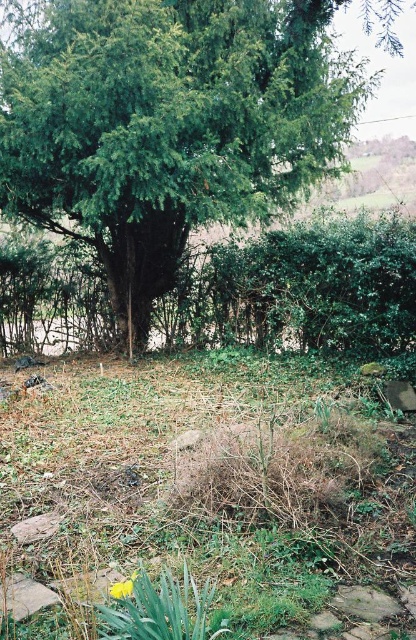
Question: Does green grass at center appear over green leafy hedge at center?

Choices:
 (A) yes
 (B) no

Answer: (B)

Question: Among these objects, which one is nearest to the camera?

Choices:
 (A) green grass at center
 (B) green leafy tree at center
 (C) yellow matte flower at lower center
 (D) green leafy hedge at center

Answer: (C)

Question: Estimate the real-world distances between objects in this image. Which object is farther from the green leafy hedge at center?

Choices:
 (A) green grass at center
 (B) green leafy tree at center
 (C) yellow matte flower at lower center

Answer: (C)

Question: Is green leafy hedge at center positioned at the back of yellow matte flower at lower center?

Choices:
 (A) yes
 (B) no

Answer: (A)

Question: Observing the image, what is the correct spatial positioning of green grass at center in reference to green leafy tree at center?

Choices:
 (A) below
 (B) above

Answer: (A)

Question: Which of these objects is positioned closest to the yellow matte flower at lower center?

Choices:
 (A) green leafy tree at center
 (B) green grass at center

Answer: (B)